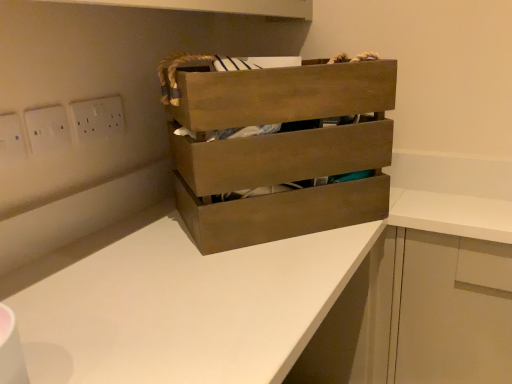
The width and height of the screenshot is (512, 384). What are the coordinates of `vacant area on top of white matte cabinet at lower right (from a real-world perspective)` in the screenshot? It's located at (440, 197).